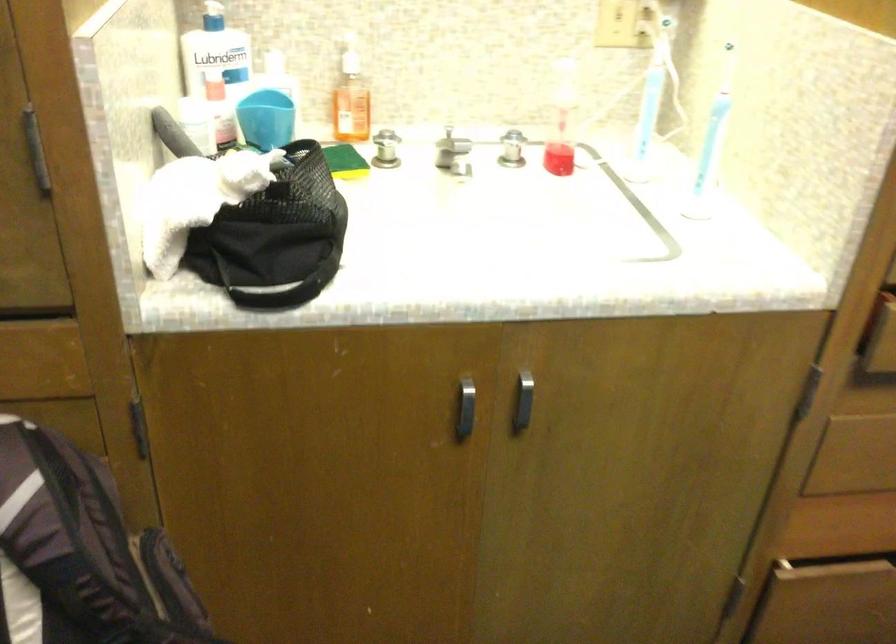
The height and width of the screenshot is (644, 896). What are the coordinates of `blue plastic cup` in the screenshot? It's located at (265, 118).